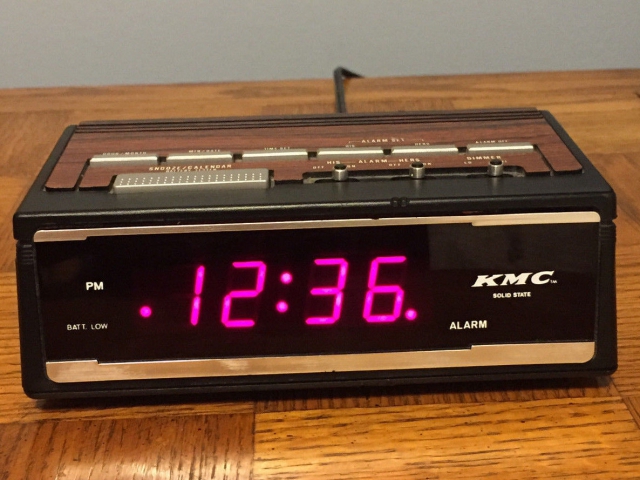
Find the location of a particular element. This screenshot has width=640, height=480. knobs is located at coordinates (340, 172), (419, 175), (493, 164).